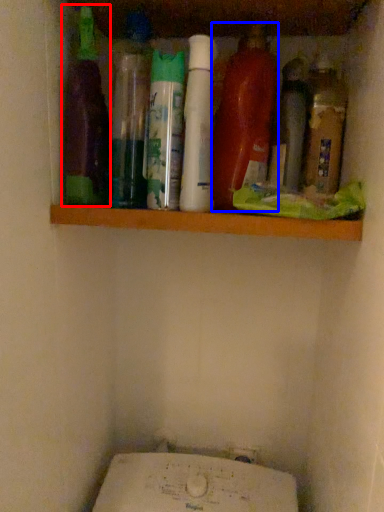
Question: Which of the following is the farthest to the observer, bottle (highlighted by a red box) or bottle (highlighted by a blue box)?

Choices:
 (A) bottle
 (B) bottle

Answer: (B)